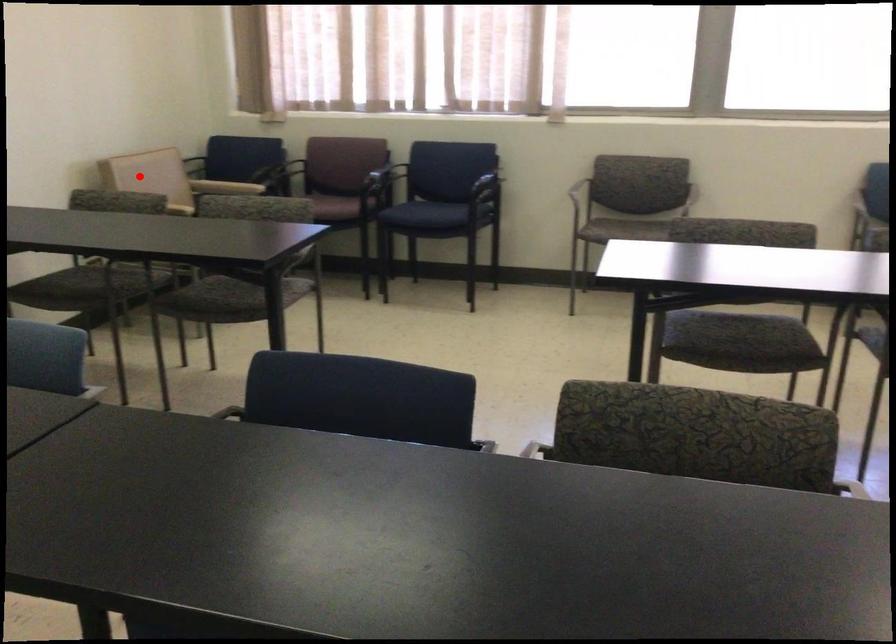
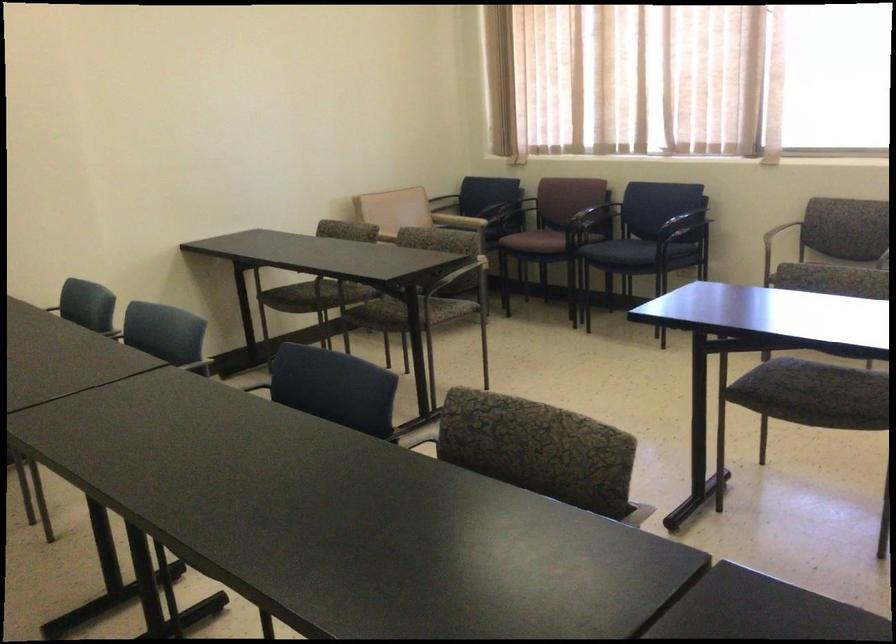
Find the pixel in the second image that matches the highlighted location in the first image.

(381, 205)